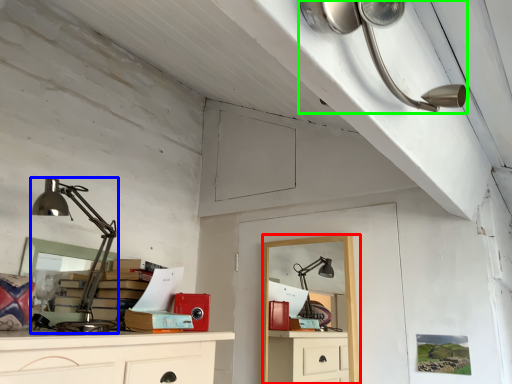
Question: Which object is positioned farthest from computer desk (highlighted by a red box)? Select from lamp (highlighted by a blue box) and lamp (highlighted by a green box).

Choices:
 (A) lamp
 (B) lamp

Answer: (B)